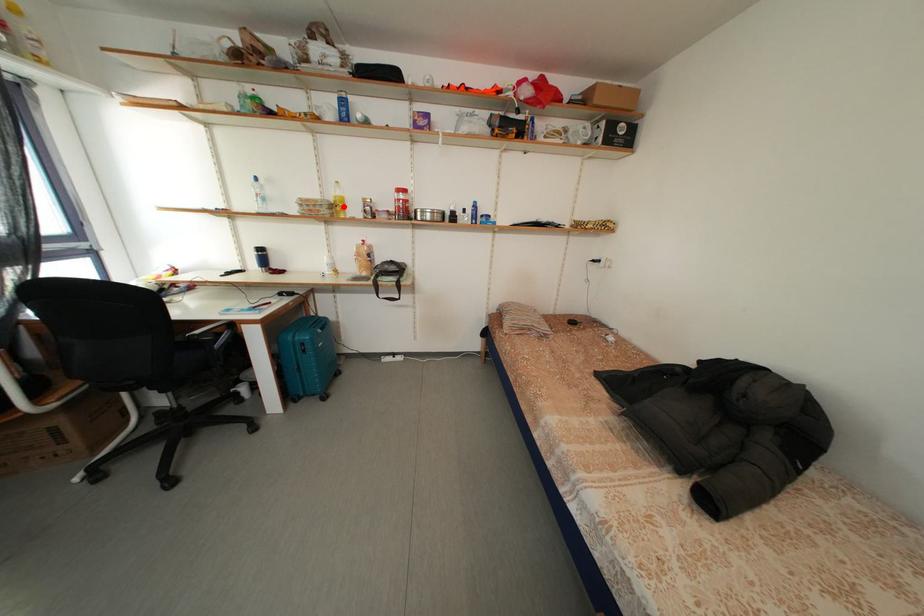
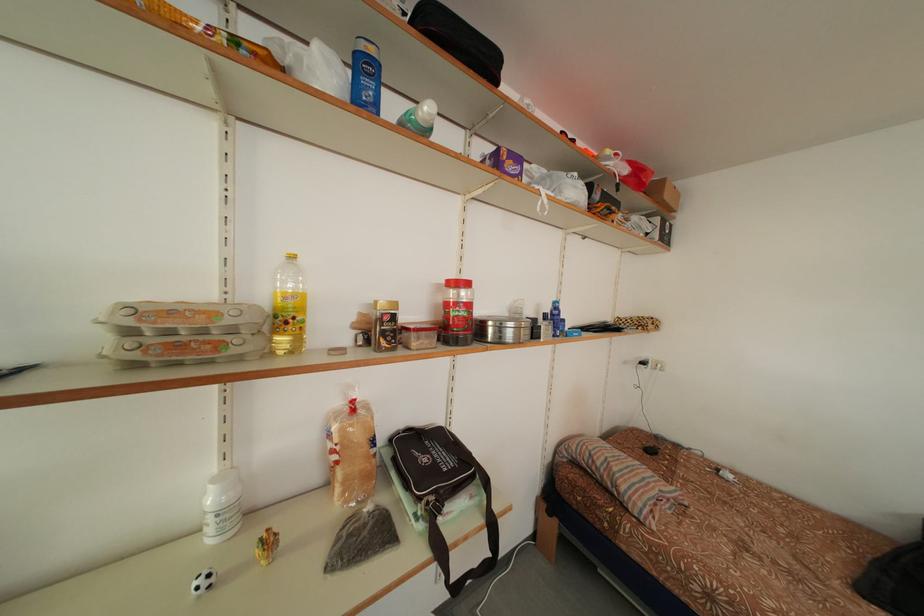
Find the pixel in the second image that matches the highlighted location in the first image.

(292, 314)